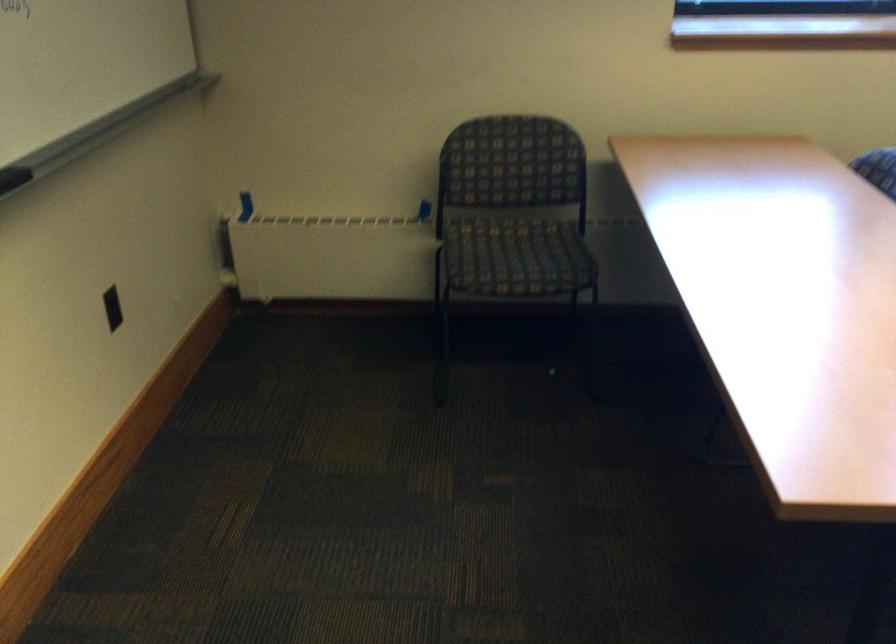
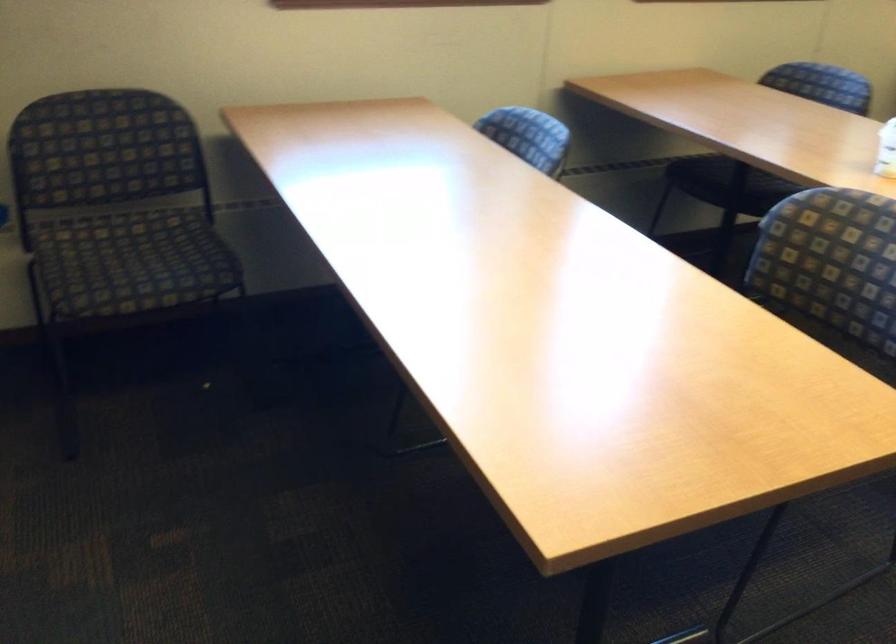
Find the pixel in the second image that matches point 507,252 in the first image.

(131, 261)